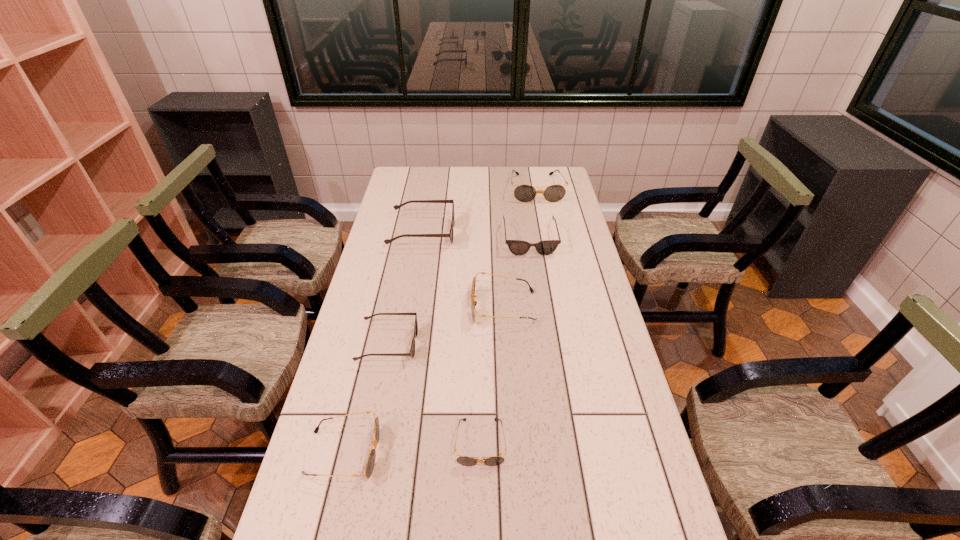
Locate an element on the screen. the farthest sunglasses is located at coordinates (524, 193).

At what (x,y) coordinates should I click in order to perform the action: click on the farthest black sunglasses. Please return your answer as a coordinate pair (x, y). The width and height of the screenshot is (960, 540). Looking at the image, I should click on (524, 193).

I want to click on the biggest brown sunglasses, so click(450, 235).

The image size is (960, 540). Identify the location of the second farthest black sunglasses. pos(473,303).

At what (x,y) coordinates should I click in order to perform the action: click on the rightmost brown sunglasses. Please return your answer as a coordinate pair (x, y). The width and height of the screenshot is (960, 540). Looking at the image, I should click on (518, 247).

Where is `the third biggest black sunglasses`? the third biggest black sunglasses is located at coordinates (369, 466).

This screenshot has height=540, width=960. I want to click on the smallest brown sunglasses, so click(412, 350).

Locate an element on the screen. The image size is (960, 540). the smallest black sunglasses is located at coordinates (463, 460).

Where is `the shortest object`? The width and height of the screenshot is (960, 540). the shortest object is located at coordinates (463, 460).

Locate an element on the screen. Image resolution: width=960 pixels, height=540 pixels. vacant point located on the front-facing side of the biggest black sunglasses is located at coordinates (543, 226).